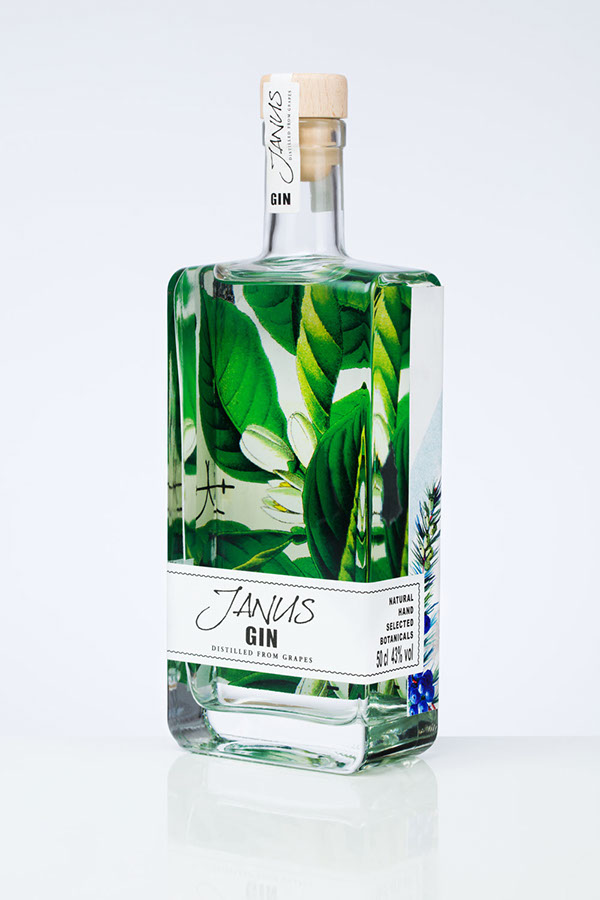
Identify the location of white glossy tabletop under bottle. The width and height of the screenshot is (600, 900). (143, 819), (498, 821).